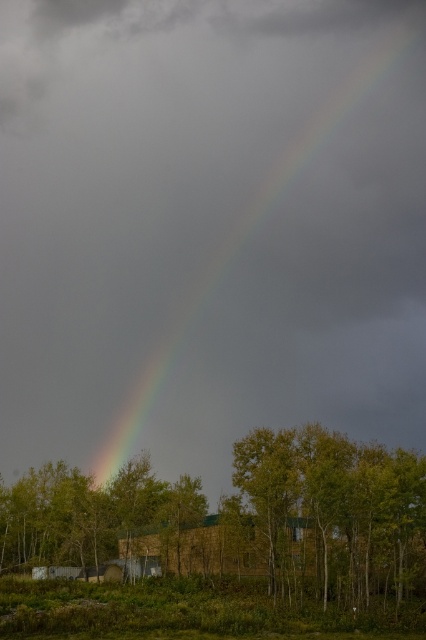
You are standing in the scene and want to take a photo of the brown wooden hut at center without the green leafy tree at lower center blocking the view. Where should you move to achieve this?

Move behind the green leafy tree at lower center so that it is between you and the brown wooden hut at center. Since the green leafy tree at lower center is in front of the brown wooden hut at center, moving behind it will allow you to see the hut without obstruction.

You are standing at the center of the image and want to locate the green leafy tree at lower center. Which direction should you look to find it?

The green leafy tree at lower center is located at point (227, 532), so you should look towards the lower center direction to find it.

Looking at this image, you are standing in a field looking at the rainbow. There is a point at coordinates (247,236). What does this point indicate?

The point at coordinates (247,236) indicates the rainbow at upper center.